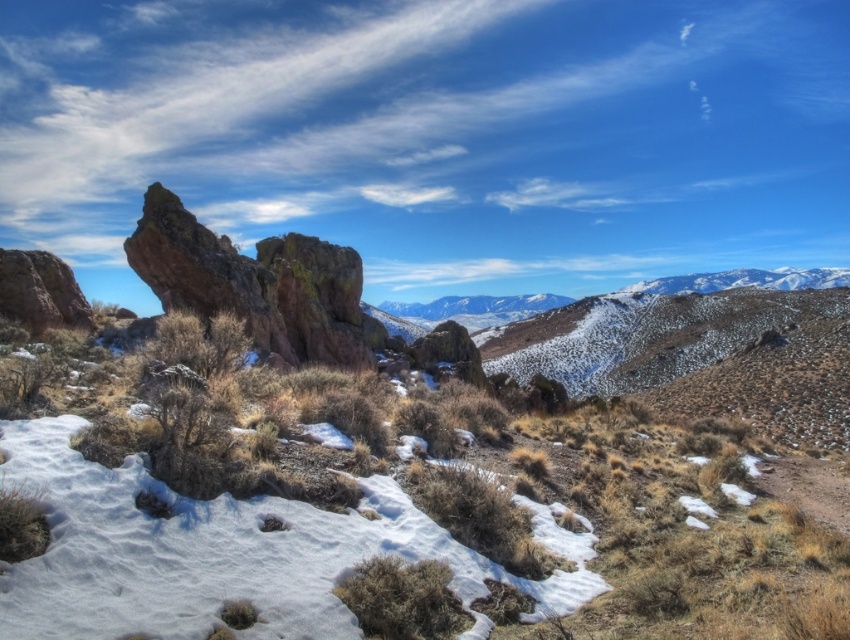
Question: Can you confirm if rustic rock formation at center is positioned to the left of rustic brown rock at center-left?

Choices:
 (A) no
 (B) yes

Answer: (A)

Question: Is rustic rock formation at center bigger than rustic brown rock at center-left?

Choices:
 (A) yes
 (B) no

Answer: (A)

Question: From the image, what is the correct spatial relationship of rustic rock formation at center in relation to rustic brown rock at center-left?

Choices:
 (A) right
 (B) left

Answer: (A)